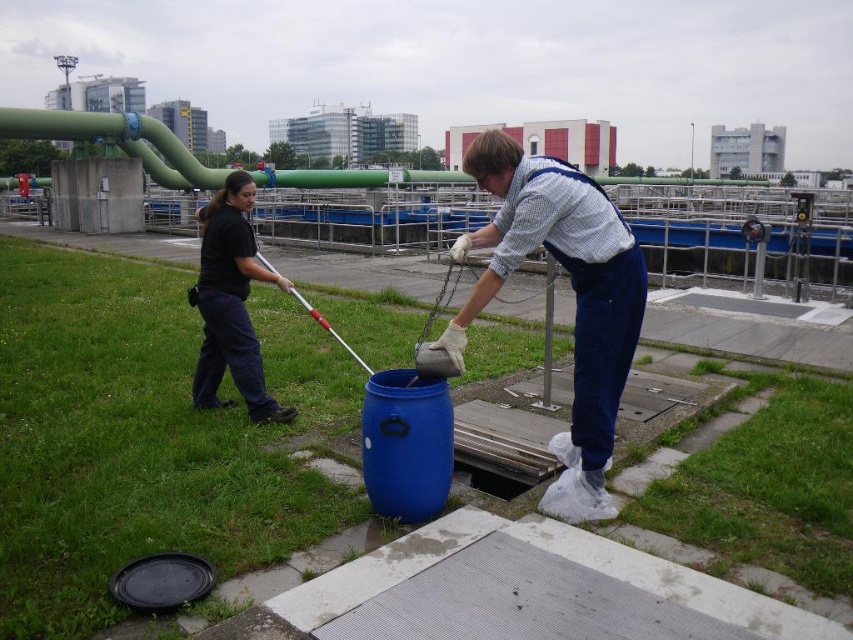
Based on the scene description, where is the blue denim overalls at center located in terms of its 2D coordinates?

The blue denim overalls at center is located at the 2D coordinates point (573,296).

You are a safety inspector observing the scene. You notice two workers wearing blue denim overalls at center and black fabric pants at left. According to safety protocols, workers must wear protective gear over their clothing. Which worker is violating the safety protocol by not wearing protective gear properly?

The black fabric pants at left is violating the safety protocol because the blue denim overalls at center is positioned under it, indicating that the protective gear is not worn over the clothing as required.